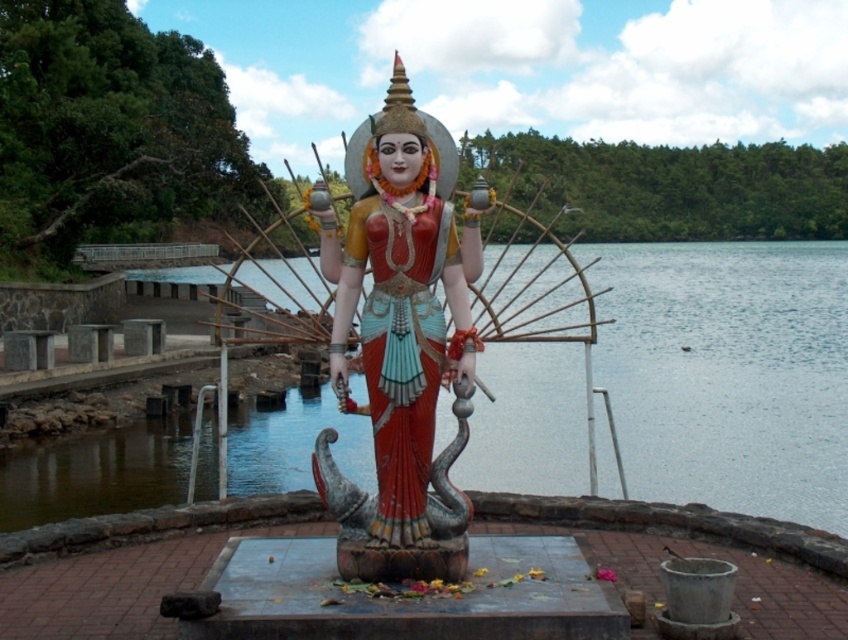
Does polished bronze statue at center have a lesser height compared to polished wood statue at center?

In fact, polished bronze statue at center may be taller than polished wood statue at center.

From the picture: Who is more distant from viewer, (427,244) or (453,579)?

Point (427,244)

Locate an element on the screen. Image resolution: width=848 pixels, height=640 pixels. polished bronze statue at center is located at coordinates (399, 346).

Is clear water at statue center positioned at the back of polished bronze statue at center?

That is True.

Image resolution: width=848 pixels, height=640 pixels. Identify the location of clear water at statue center. point(729,372).

Identify the location of clear water at statue center. (729, 372).

Is clear water at statue center above polished wood statue at center?

Indeed, clear water at statue center is positioned over polished wood statue at center.

The height and width of the screenshot is (640, 848). I want to click on clear water at statue center, so click(x=729, y=372).